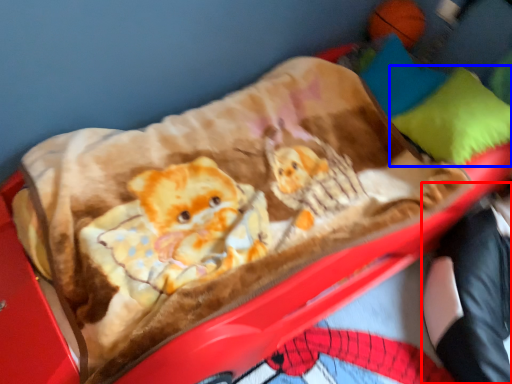
Question: Which object appears closest to the camera in this image, couple (highlighted by a red box) or pillow (highlighted by a blue box)?

Choices:
 (A) couple
 (B) pillow

Answer: (A)